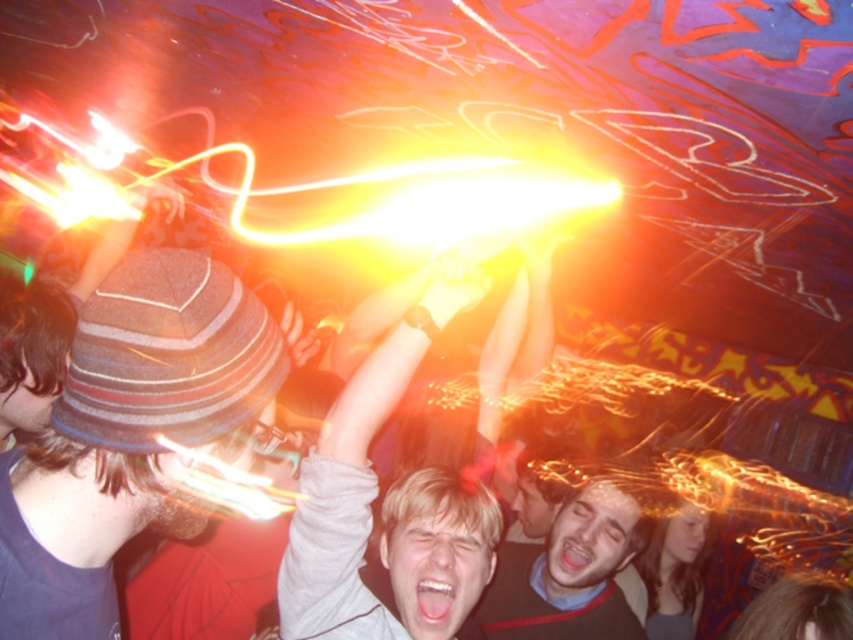
Question: Which object is positioned closest to the striped wool hat at left?

Choices:
 (A) smooth gray shirt at center
 (B) smooth black sweater at center

Answer: (A)

Question: Is the position of striped wool hat at left more distant than that of smooth gray shirt at center?

Choices:
 (A) no
 (B) yes

Answer: (A)

Question: Based on their relative distances, which object is nearer to the smooth black sweater at center?

Choices:
 (A) smooth gray shirt at center
 (B) striped wool hat at left

Answer: (A)

Question: Considering the real-world distances, which object is closest to the smooth gray shirt at center?

Choices:
 (A) smooth black sweater at center
 (B) striped wool hat at left

Answer: (B)

Question: Does smooth gray shirt at center appear over smooth black sweater at center?

Choices:
 (A) no
 (B) yes

Answer: (B)

Question: Can you confirm if smooth gray shirt at center is bigger than smooth black sweater at center?

Choices:
 (A) yes
 (B) no

Answer: (B)